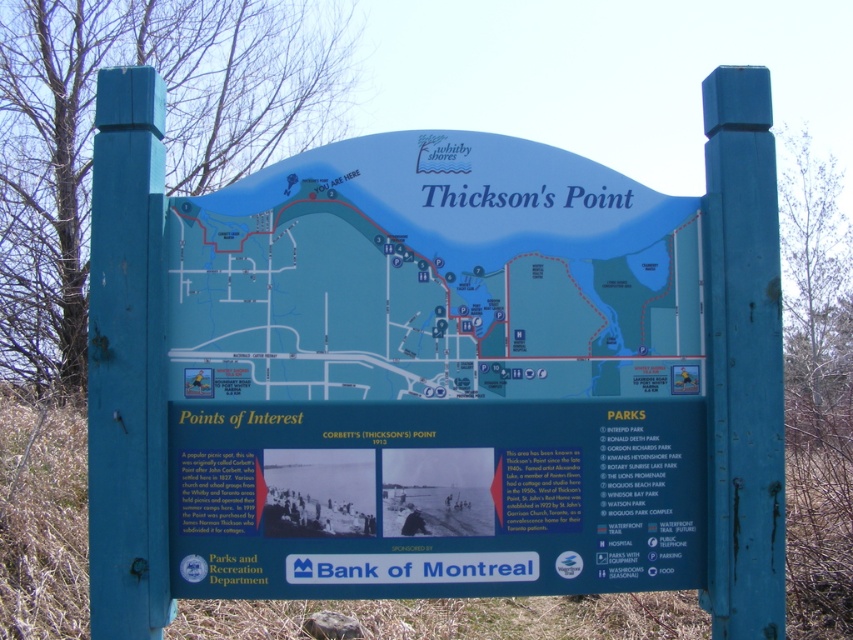
Is blue plastic map at center to the right of matte blue signboard at center from the viewer's perspective?

Incorrect, blue plastic map at center is not on the right side of matte blue signboard at center.

Can you confirm if blue plastic map at center is shorter than matte blue signboard at center?

Incorrect, blue plastic map at center's height does not fall short of matte blue signboard at center's.

Between point (320, 337) and point (352, 442), which one is positioned in front?

Positioned in front is point (352, 442).

Where is `blue plastic map at center`? blue plastic map at center is located at coordinates (434, 276).